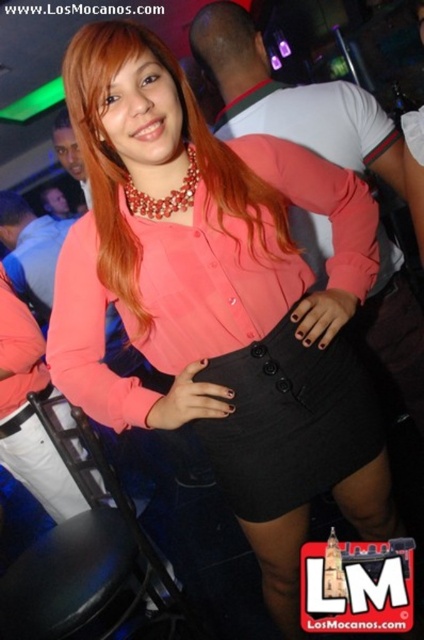
Is point (222, 380) positioned in front of point (156, 202)?

No, it is not.

The image size is (424, 640). What are the coordinates of `black textured skirt at center` in the screenshot? It's located at (289, 422).

Is blonde silky hair at center positioned at the back of pearl-like beads necklace at center?

No, it is in front of pearl-like beads necklace at center.

Is blonde silky hair at center shorter than pearl-like beads necklace at center?

Incorrect, blonde silky hair at center's height does not fall short of pearl-like beads necklace at center's.

At what (x,y) coordinates should I click in order to perform the action: click on blonde silky hair at center. Please return your answer as a coordinate pair (x, y). The height and width of the screenshot is (640, 424). Looking at the image, I should click on [x=127, y=170].

Does point (356, 392) lie in front of point (88, 154)?

No, it is not.

Between black textured skirt at center and blonde silky hair at center, which one is positioned lower?

black textured skirt at center is lower down.

Is point (228, 481) farther from camera compared to point (111, 268)?

Yes, point (228, 481) is farther from viewer.

You are a GUI agent. You are given a task and a screenshot of the screen. Output one action in this format:
    pyautogui.click(x=<x>, y=<y>)
    Task: Click on the black textured skirt at center
    The width and height of the screenshot is (424, 640).
    Given the screenshot: What is the action you would take?
    pyautogui.click(x=289, y=422)